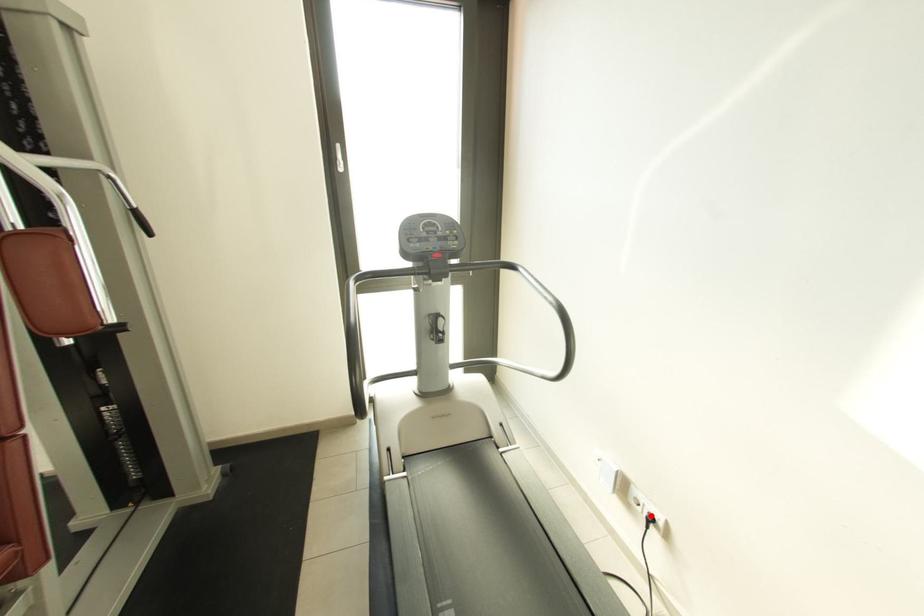
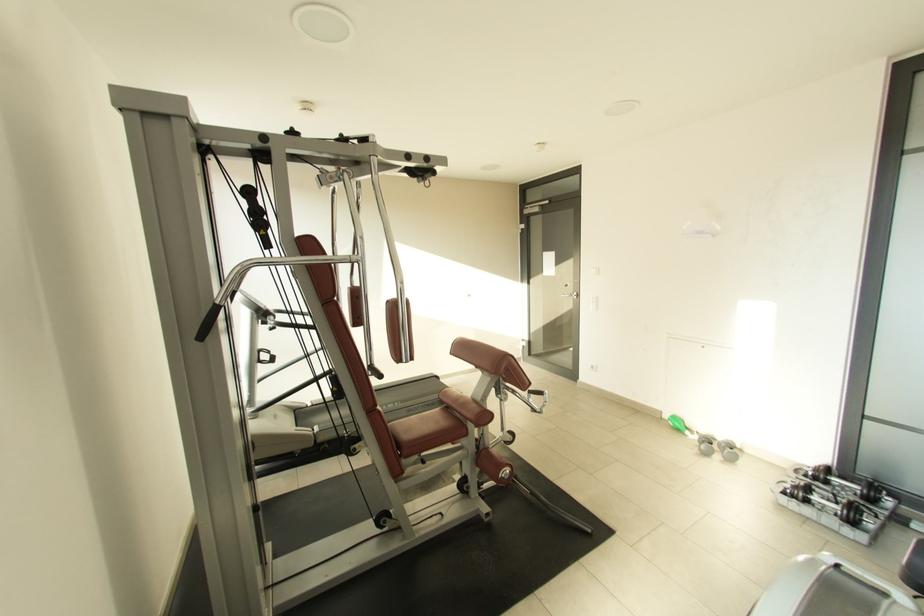
Question: I am providing you with two images of the same scene from different viewpoints. A red point is marked on the first image. At the location where the point appears in image 1, is it still visible in image 2?

Choices:
 (A) Yes
 (B) No

Answer: (B)